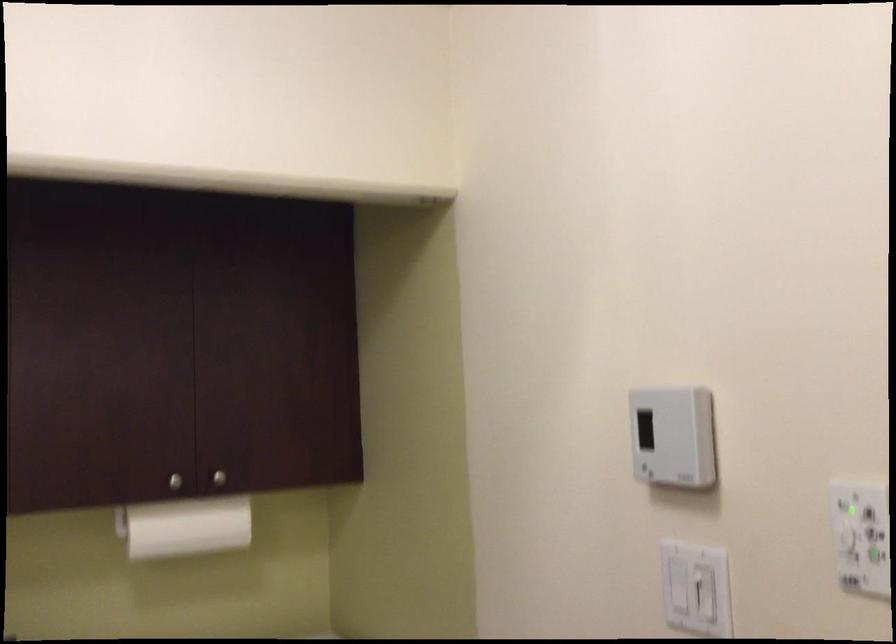
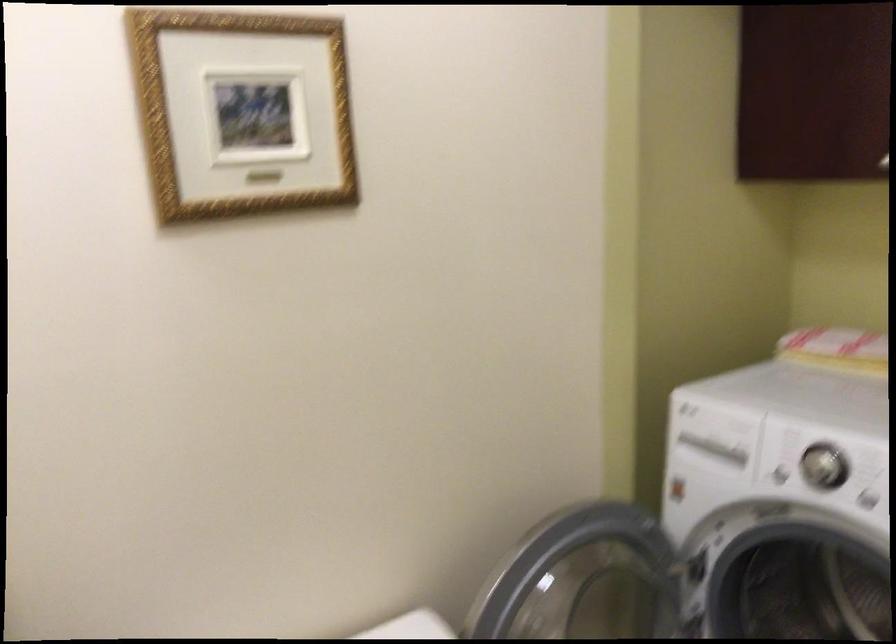
Question: The camera is either moving clockwise (left) or counter-clockwise (right) around the object. The first image is from the beginning of the video and the second image is from the end. Is the camera moving left or right when shooting the video?

Choices:
 (A) Left
 (B) Right

Answer: (B)